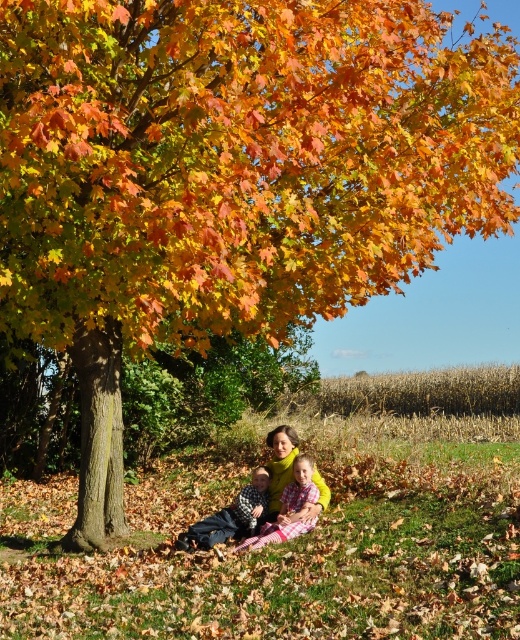
Question: In this image, where is yellow fabric at lower center located relative to matte black jacket at lower center?

Choices:
 (A) below
 (B) above

Answer: (B)

Question: Which point is farther to the camera?

Choices:
 (A) (253, 513)
 (B) (268, 488)

Answer: (B)

Question: Which of these objects is positioned farthest from the yellow fabric at lower center?

Choices:
 (A) yellow wool scarf at center
 (B) matte black jacket at lower center

Answer: (B)

Question: Does yellow fabric at lower center appear over yellow wool scarf at center?

Choices:
 (A) no
 (B) yes

Answer: (A)

Question: Which of the following is the farthest from the observer?

Choices:
 (A) (238, 515)
 (B) (274, 444)

Answer: (B)

Question: In this image, where is yellow fabric at lower center located relative to matte black jacket at lower center?

Choices:
 (A) left
 (B) right

Answer: (B)